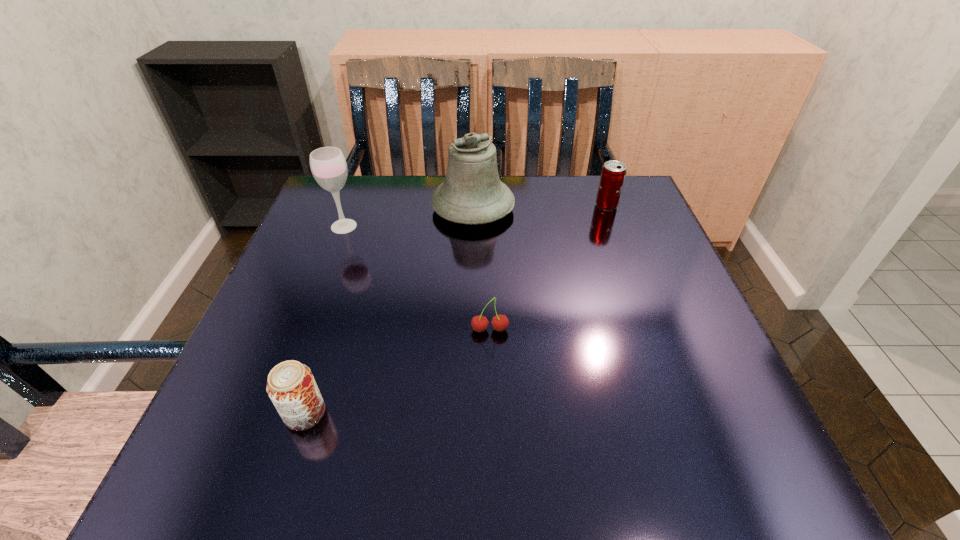
Where is `object identified as the closest to the second nearest object`? The image size is (960, 540). object identified as the closest to the second nearest object is located at coordinates (291, 386).

The image size is (960, 540). What are the coordinates of `vacant space that satisfies the following two spatial constraints: 1. on the back side of the nearer beer can; 2. on the left side of the bell` in the screenshot? It's located at (371, 207).